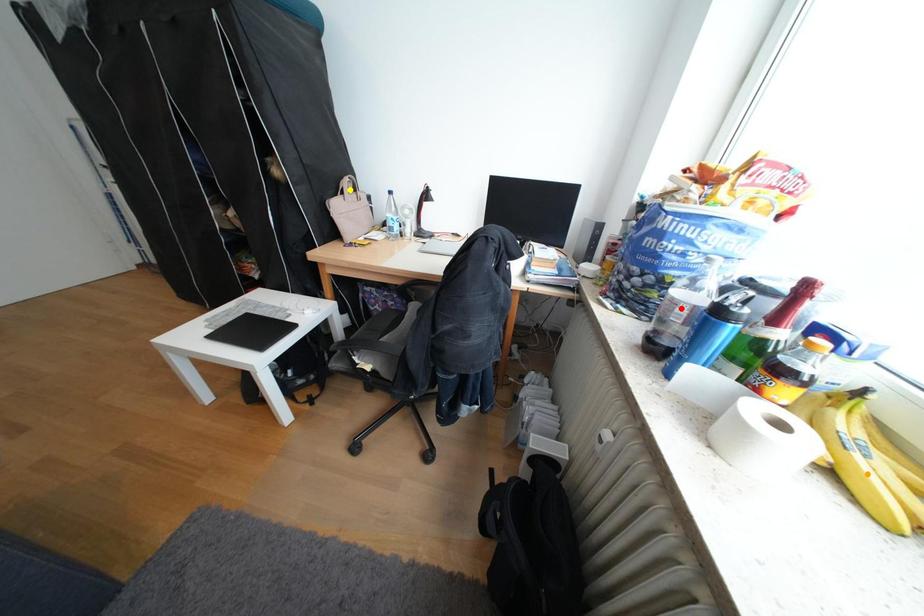
Order these from nearest to farthest:
orange point | red point | yellow point

yellow point < red point < orange point